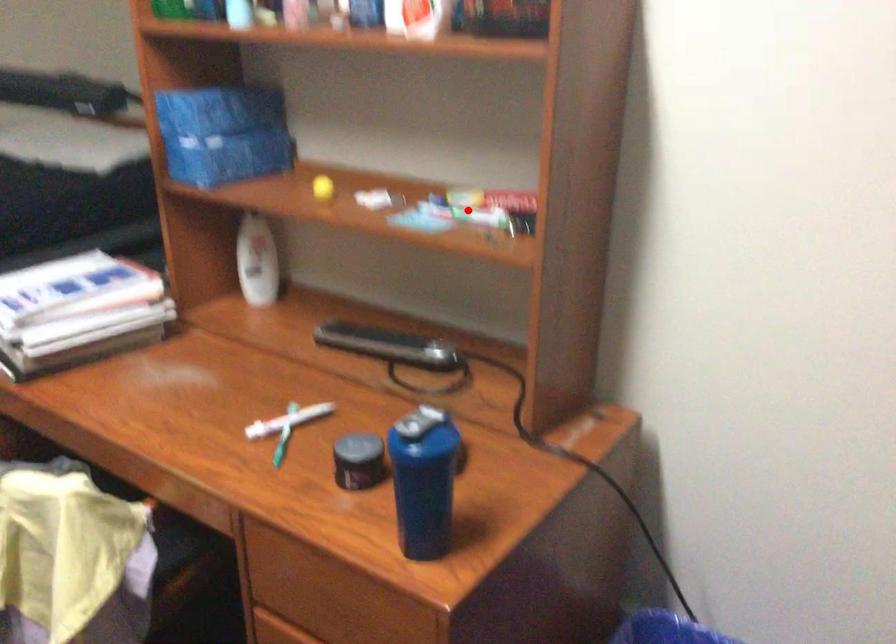
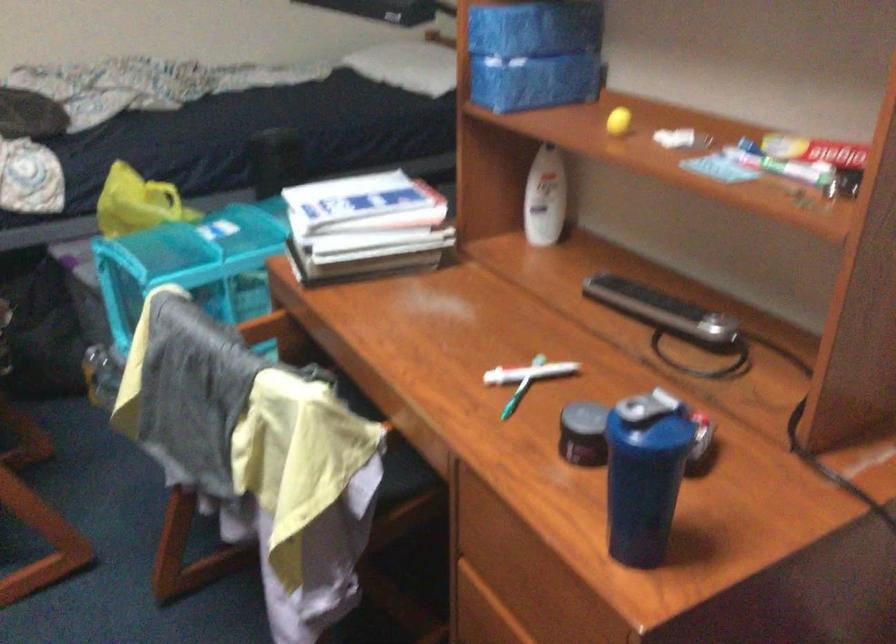
Question: I am providing you with two images of the same scene from different viewpoints. In image1, a red point is highlighted. Considering the same 3D point in image2, which of the following is correct?

Choices:
 (A) It is closer
 (B) It is farther

Answer: (A)